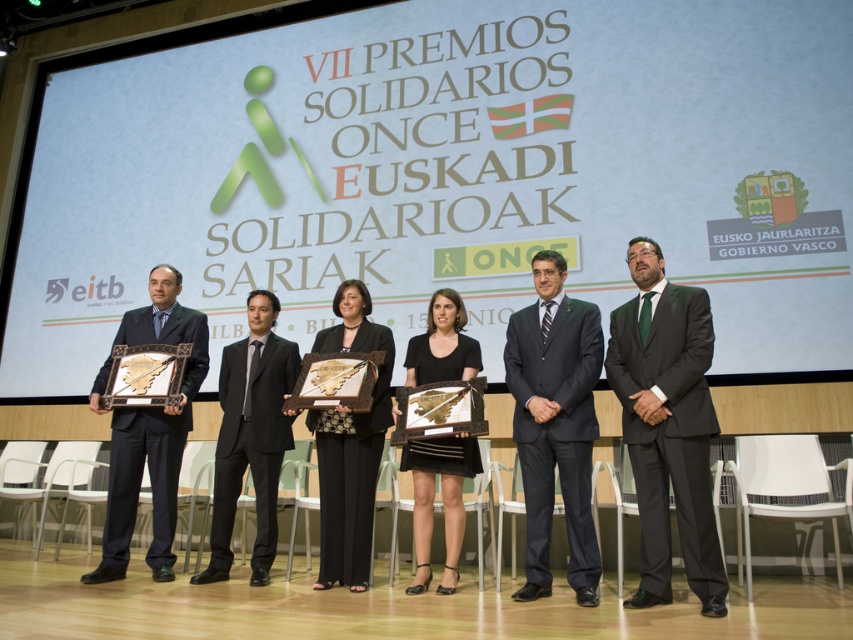
Is matte gold frame at left bigger than black satin dress at center?

Yes, matte gold frame at left is bigger than black satin dress at center.

From the picture: Which is more to the left, matte gold frame at left or black satin dress at center?

matte gold frame at left is more to the left.

Who is more distant from viewer, (x=125, y=564) or (x=456, y=586)?

Positioned behind is point (x=125, y=564).

Identify the location of matte gold frame at left. The width and height of the screenshot is (853, 640). (151, 433).

Can you confirm if dark blue suit at center is taller than black satin dress at center?

Correct, dark blue suit at center is much taller as black satin dress at center.

Is dark blue suit at center thinner than black satin dress at center?

No.

Is point (585, 552) positioned in front of point (432, 486)?

That is True.

Find the location of a particular element. Image resolution: width=853 pixels, height=640 pixels. dark blue suit at center is located at coordinates (555, 422).

Which of these two, dark green suit at center or dark blue suit at center, stands shorter?

dark green suit at center is shorter.

Identify the location of dark green suit at center. The image size is (853, 640). (666, 426).

Between point (695, 540) and point (570, 330), which one is positioned in front?

Positioned in front is point (695, 540).

You are a GUI agent. You are given a task and a screenshot of the screen. Output one action in this format:
    pyautogui.click(x=<x>, y=<y>)
    Task: Click on the dark green suit at center
    The image size is (853, 640).
    Given the screenshot: What is the action you would take?
    pyautogui.click(x=666, y=426)